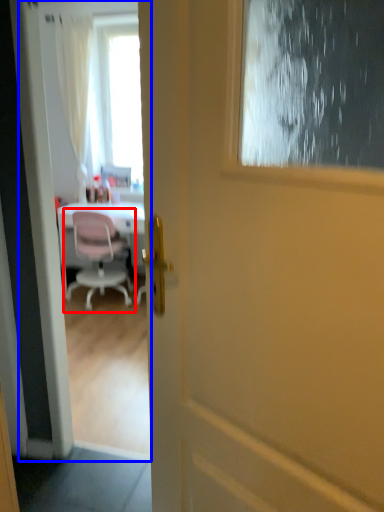
Question: Which of the following is the farthest to the observer, chair (highlighted by a red box) or screen door (highlighted by a blue box)?

Choices:
 (A) chair
 (B) screen door

Answer: (A)